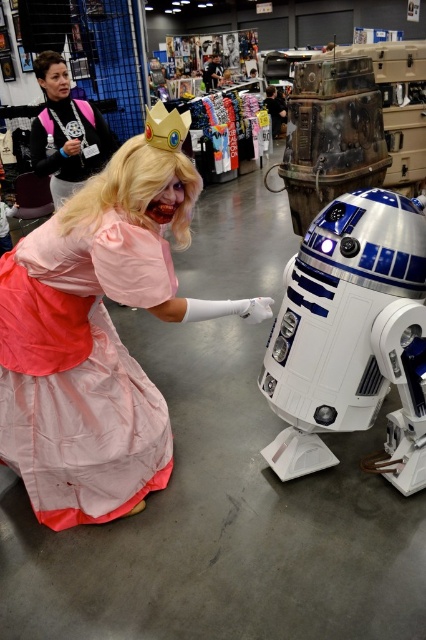
From the picture: Can you confirm if pink satin dress at center is bigger than blonde synthetic wig at upper left?

Correct, pink satin dress at center is larger in size than blonde synthetic wig at upper left.

Can you confirm if pink satin dress at center is taller than blonde synthetic wig at upper left?

Correct, pink satin dress at center is much taller as blonde synthetic wig at upper left.

Does point (109, 413) come in front of point (115, 184)?

No, (109, 413) is further to viewer.

The image size is (426, 640). Find the location of `pink satin dress at center`. pink satin dress at center is located at coordinates (80, 371).

Describe the element at coordinates (80, 371) in the screenshot. I see `pink satin dress at center` at that location.

Can you confirm if pink satin dress at center is positioned above matte black jacket at upper left?

Actually, pink satin dress at center is below matte black jacket at upper left.

I want to click on pink satin dress at center, so click(x=80, y=371).

Between point (108, 186) and point (100, 129), which one is positioned behind?

The point (100, 129) is more distant.

Who is shorter, blonde synthetic wig at upper left or matte black jacket at upper left?

blonde synthetic wig at upper left

Where is `blonde synthetic wig at upper left`? The image size is (426, 640). blonde synthetic wig at upper left is located at coordinates (135, 189).